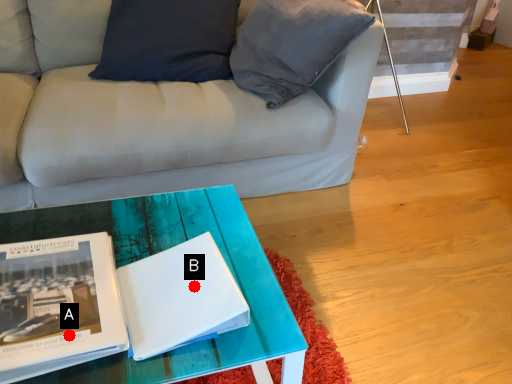
Question: Two points are circled on the image, labeled by A and B beside each circle. Which point is closer to the camera?

Choices:
 (A) A is closer
 (B) B is closer

Answer: (A)